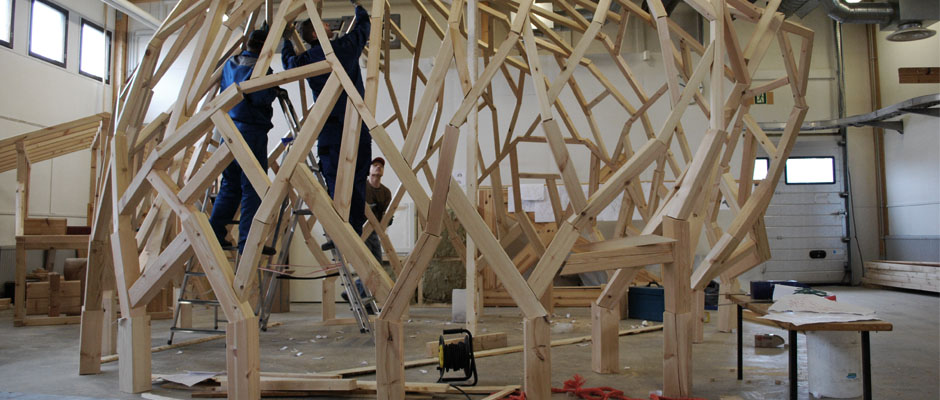
Find the location of a particular element. This screenshot has width=940, height=400. black chair is located at coordinates (461, 353).